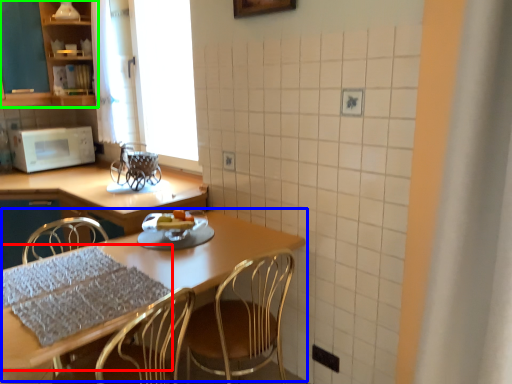
Question: Which object is the farthest from tablecloth (highlighted by a red box)? Choose among these: table (highlighted by a blue box) or cabinetry (highlighted by a green box).

Choices:
 (A) table
 (B) cabinetry

Answer: (B)